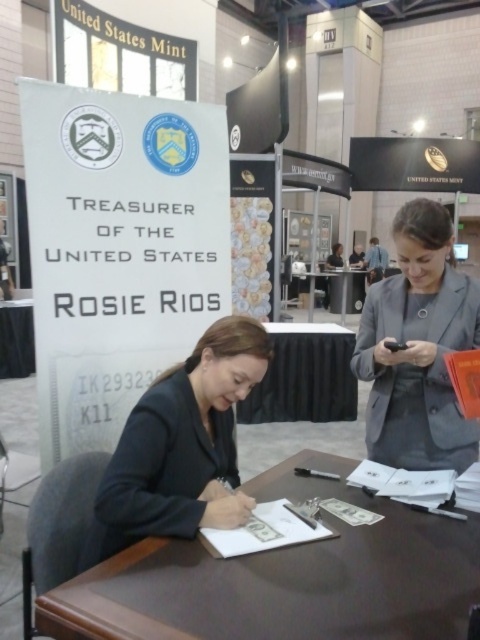
Is brown wood table at center above black matte blazer at center?

Actually, brown wood table at center is below black matte blazer at center.

The width and height of the screenshot is (480, 640). I want to click on brown wood table at center, so click(285, 579).

Between black matte blazer at center and gray fabric jacket at upper right, which one is positioned lower?

black matte blazer at center is below.

How distant is black matte blazer at center from gray fabric jacket at upper right?

black matte blazer at center and gray fabric jacket at upper right are 25.64 inches apart from each other.

Does point (173, 460) come farther from viewer compared to point (399, 227)?

No, it is not.

In order to click on black matte blazer at center in this screenshot , I will do `click(180, 445)`.

Looking at this image, can you confirm if brown wood table at center is shorter than black glossy table at lower left?

Indeed, brown wood table at center has a lesser height compared to black glossy table at lower left.

Can you confirm if brown wood table at center is positioned to the right of black glossy table at lower left?

Yes, brown wood table at center is to the right of black glossy table at lower left.

Is point (45, 602) farther from viewer compared to point (15, 358)?

No, it is not.

Find the location of a particular element. brown wood table at center is located at coordinates (285, 579).